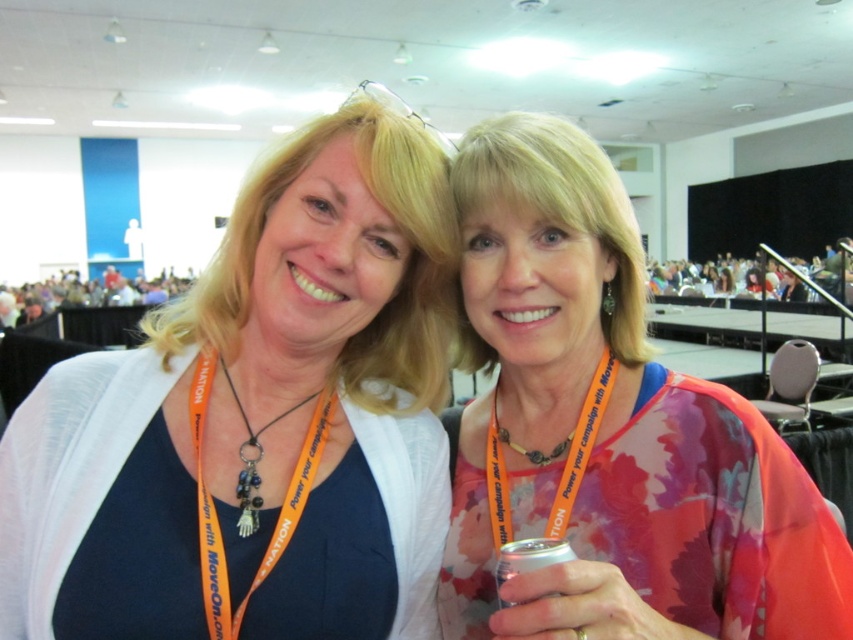
You are taking a photo of two women standing in front of you. You notice two points marked in the image. Which point is closer to your camera, point 1 at position (x=387, y=612) or point 2 at position (x=250, y=451)?

Point 1 at position (x=387, y=612) is closer to the camera than point 2 at position (x=250, y=451).